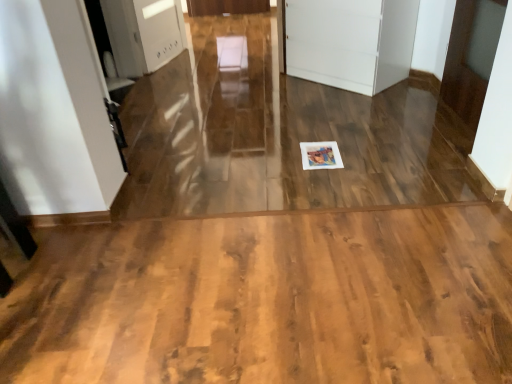
Question: Can you confirm if white glossy door at upper right, which is counted as the 1th door, starting from the right, is smaller than wooden floor at center?

Choices:
 (A) yes
 (B) no

Answer: (A)

Question: Is white glossy door at upper right, which is counted as the 1th door, starting from the right, in front of wooden floor at center?

Choices:
 (A) no
 (B) yes

Answer: (A)

Question: Are white glossy door at upper right, which ranks as the 2th door in left-to-right order, and wooden floor at center far apart?

Choices:
 (A) yes
 (B) no

Answer: (A)

Question: Considering the relative positions of white glossy door at upper right, which is counted as the 1th door, starting from the right, and wooden floor at center in the image provided, is white glossy door at upper right, which is counted as the 1th door, starting from the right, to the left of wooden floor at center from the viewer's perspective?

Choices:
 (A) yes
 (B) no

Answer: (B)

Question: Is white glossy door at upper right, which is counted as the 1th door, starting from the right, turned away from wooden floor at center?

Choices:
 (A) no
 (B) yes

Answer: (A)

Question: Could you tell me if white glossy door at upper right, which is counted as the 1th door, starting from the right, is facing wooden floor at center?

Choices:
 (A) no
 (B) yes

Answer: (A)

Question: Is wooden floor at center at the left side of white matte cabinet at center, which is the 2th door from right to left?

Choices:
 (A) no
 (B) yes

Answer: (B)

Question: Can you confirm if wooden floor at center is bigger than white matte cabinet at center, which is the 2th door from right to left?

Choices:
 (A) yes
 (B) no

Answer: (B)

Question: Can you confirm if wooden floor at center is thinner than white matte cabinet at center, which is the 2th door from right to left?

Choices:
 (A) no
 (B) yes

Answer: (A)

Question: From a real-world perspective, is wooden floor at center physically below white matte cabinet at center, which is the 2th door from right to left?

Choices:
 (A) no
 (B) yes

Answer: (B)

Question: Is white matte cabinet at center, acting as the first door starting from the left, at the back of wooden floor at center?

Choices:
 (A) yes
 (B) no

Answer: (B)

Question: Can you confirm if wooden floor at center is smaller than white matte cabinet at center, which is the 2th door from right to left?

Choices:
 (A) yes
 (B) no

Answer: (A)

Question: Is wooden floor at center positioned before white glossy door at upper right, which ranks as the 2th door in left-to-right order?

Choices:
 (A) no
 (B) yes

Answer: (B)